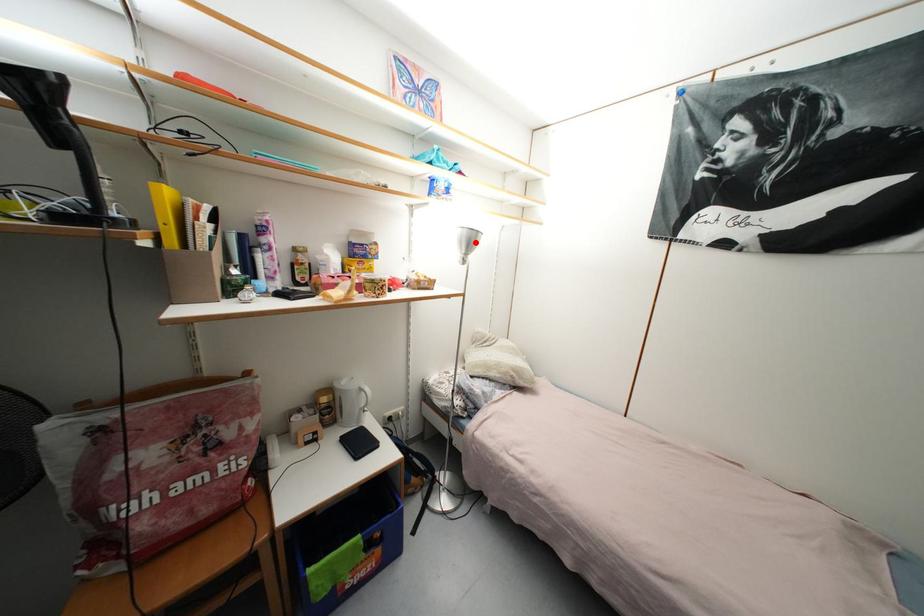
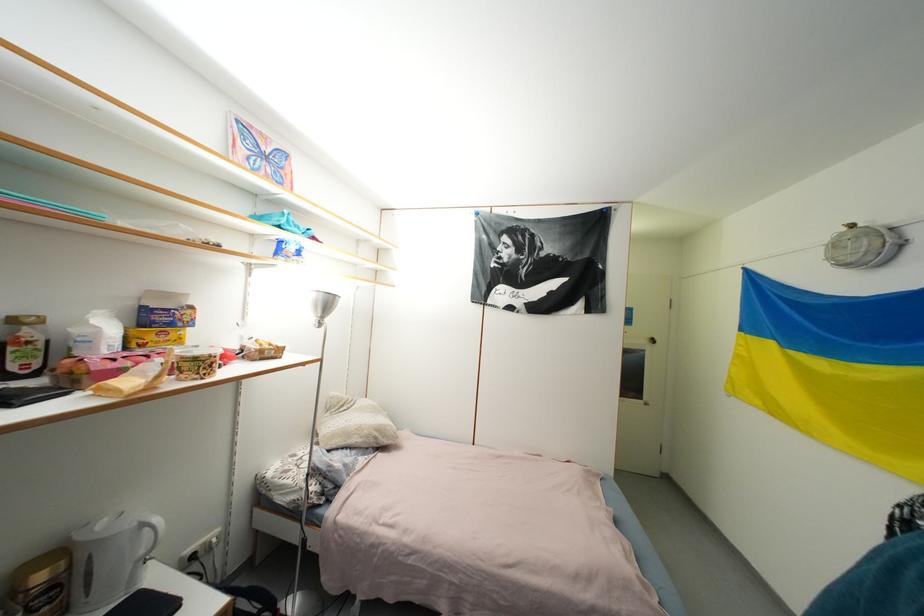
Question: A red point is marked in image1. In image2, is the corresponding 3D point closer to the camera or farther? Reply with the corresponding letter.

Choices:
 (A) The corresponding 3D point is closer.
 (B) The corresponding 3D point is farther.

Answer: (B)